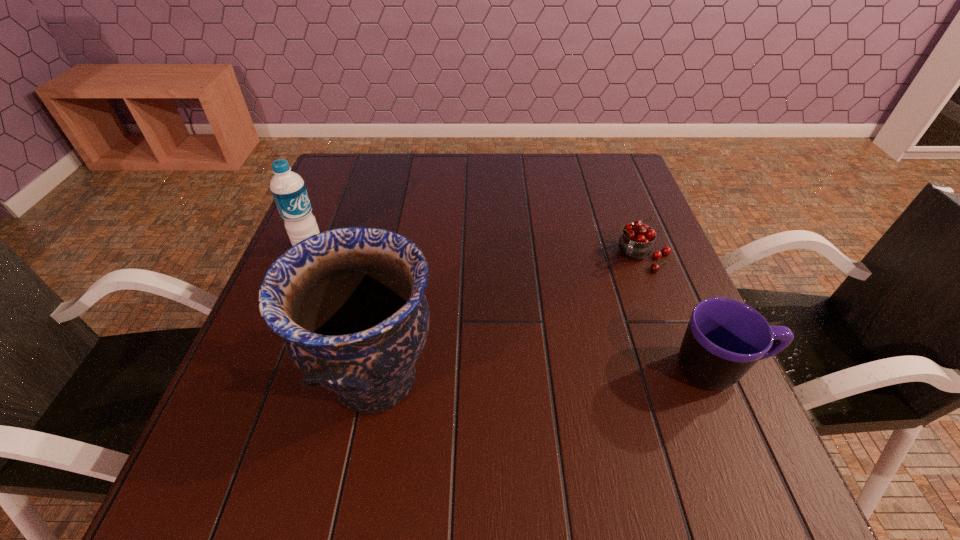
Image resolution: width=960 pixels, height=540 pixels. Find the location of `vacant space on the desktop that is between the third object from right to left and the mug and is positioned on the handle side of the pot filled with cherries`. vacant space on the desktop that is between the third object from right to left and the mug and is positioned on the handle side of the pot filled with cherries is located at coordinates (573, 374).

Locate an element on the screen. free space on the desktop that is between the second object from left to right and the mug and is positioned on the label of the leftmost object is located at coordinates (497, 376).